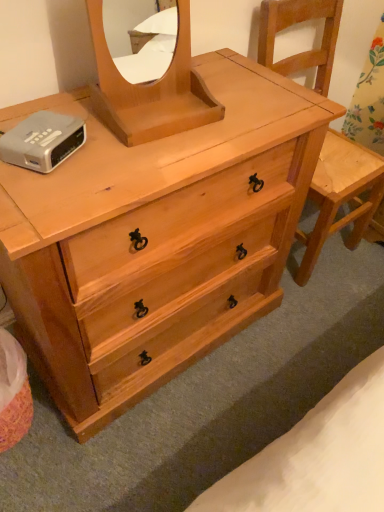
The width and height of the screenshot is (384, 512). I want to click on vacant point to the right of silver metallic alarm clock at upper left, so pos(118,165).